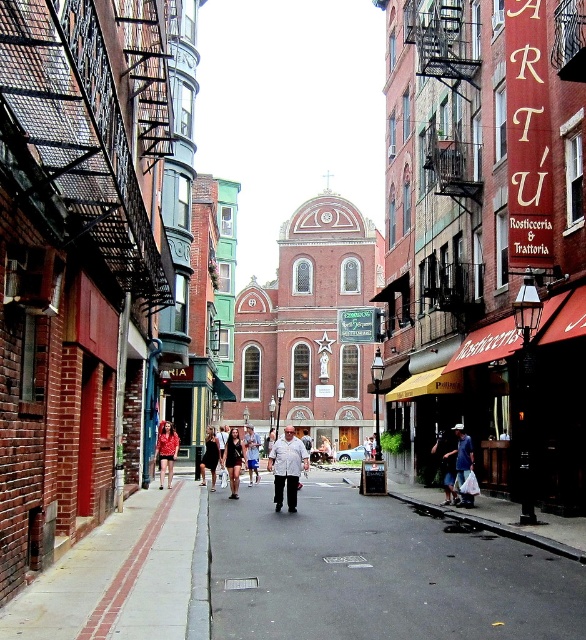
Is black asphalt at center positioned at the back of red dress at center?

No, it is not.

Between black asphalt at center and red dress at center, which one is positioned lower?

black asphalt at center is below.

Where is `black asphalt at center`? Image resolution: width=586 pixels, height=640 pixels. black asphalt at center is located at coordinates (379, 573).

Can you confirm if black asphalt at center is positioned to the right of dark blue jeans at center?

Yes, black asphalt at center is to the right of dark blue jeans at center.

Between black asphalt at center and dark blue jeans at center, which one is positioned higher?

Positioned higher is dark blue jeans at center.

Identify the location of black asphalt at center. (379, 573).

Does dark brown leather jacket at center have a greater height compared to matte black dress at center?

Correct, dark brown leather jacket at center is much taller as matte black dress at center.

Which is below, dark brown leather jacket at center or matte black dress at center?

Positioned lower is matte black dress at center.

Locate an element on the screen. This screenshot has width=586, height=640. dark brown leather jacket at center is located at coordinates (251, 452).

Locate an element on the screen. This screenshot has height=640, width=586. dark brown leather jacket at center is located at coordinates (251, 452).